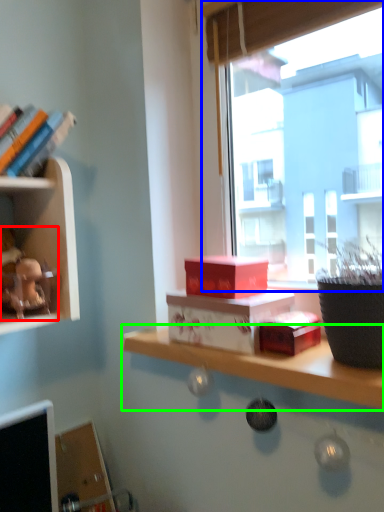
Question: Considering the real-world distances, which object is farthest from toy (highlighted by a red box)? window (highlighted by a blue box) or shelf (highlighted by a green box)?

Choices:
 (A) window
 (B) shelf

Answer: (A)